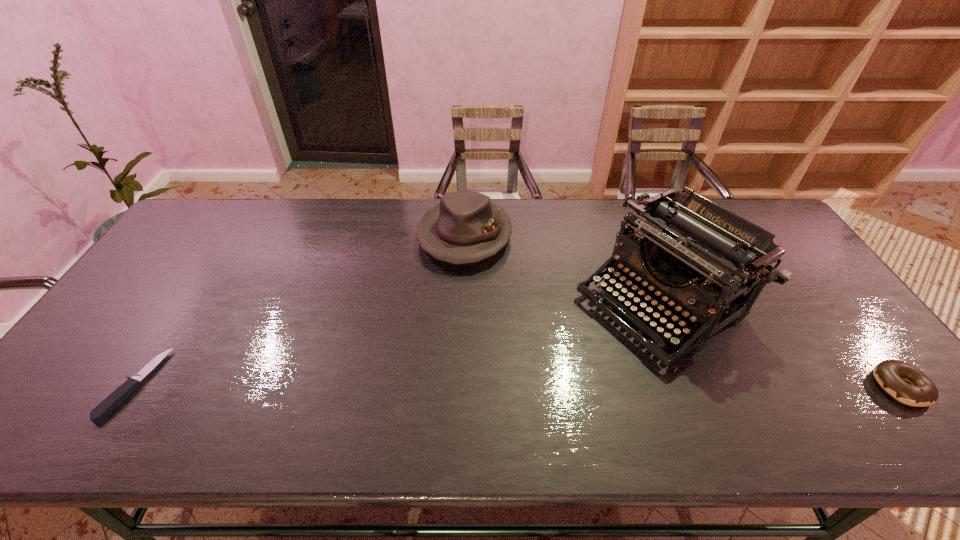
Locate an element on the screen. The height and width of the screenshot is (540, 960). vacant space situated 0.110m on the typing side of the typewriter is located at coordinates pyautogui.click(x=569, y=359).

Identify the location of free location located on the typing side of the typewriter. The image size is (960, 540). (547, 373).

This screenshot has height=540, width=960. In order to click on vacant region located on the typing side of the typewriter in this screenshot , I will do `click(515, 393)`.

Image resolution: width=960 pixels, height=540 pixels. Find the location of `free space located on the decorative side of the hat`. free space located on the decorative side of the hat is located at coordinates (451, 294).

The height and width of the screenshot is (540, 960). Identify the location of vacant space located on the decorative side of the hat. (431, 377).

Where is `vacant area situated 0.190m on the decorative side of the hat`? vacant area situated 0.190m on the decorative side of the hat is located at coordinates (444, 320).

Image resolution: width=960 pixels, height=540 pixels. I want to click on object present at the far edge, so click(x=465, y=227).

Where is `steak knife present at the near edge`? The image size is (960, 540). steak knife present at the near edge is located at coordinates (116, 398).

Locate an element on the screen. doughnut present at the near edge is located at coordinates (920, 391).

This screenshot has height=540, width=960. In order to click on typewriter present at the near edge in this screenshot , I will do `click(691, 249)`.